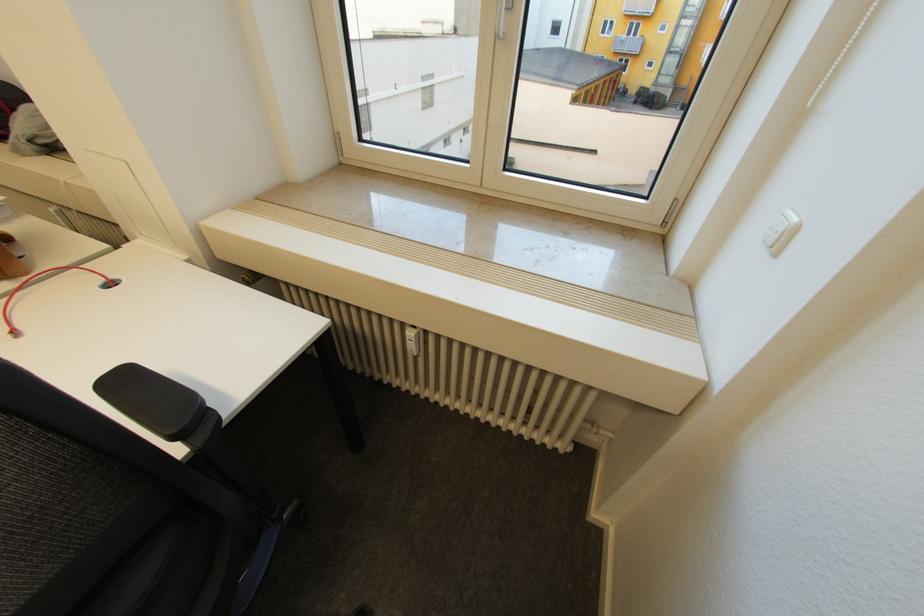
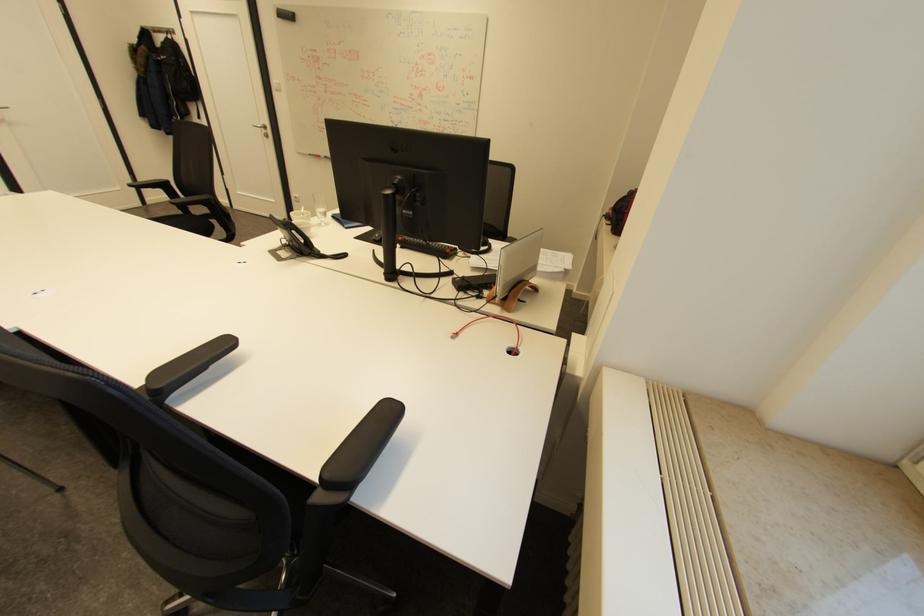
The first image is from the beginning of the video and the second image is from the end. How did the camera likely rotate when shooting the video?

The rotation direction of the camera is left-down.